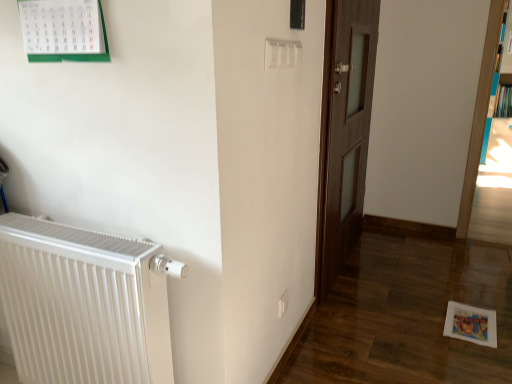
Question: Looking at their shapes, would you say dark wood door at center is wider or thinner than blue glossy bookcase at right, marked as the 1th bookcase in a back-to-front arrangement?

Choices:
 (A) wide
 (B) thin

Answer: (B)

Question: From a real-world perspective, is dark wood door at center positioned above or below blue glossy bookcase at right, the 2th bookcase viewed from the left?

Choices:
 (A) above
 (B) below

Answer: (B)

Question: Which is farther from the hardcover book at upper right?

Choices:
 (A) blue glossy bookcase at right, the 2th bookcase viewed from the left
 (B) white plastic electric outlet at lower center
 (C) dark wood door at center
 (D) wooden bookshelf at right, arranged as the 1th bookcase when viewed from the front
 (E) white metallic radiator at left

Answer: (E)

Question: Which of these objects is positioned closest to the hardcover book at upper right?

Choices:
 (A) dark wood door at center
 (B) wooden bookshelf at right, which is counted as the 1th bookcase, starting from the left
 (C) blue glossy bookcase at right, the 2th bookcase viewed from the left
 (D) white metallic radiator at left
 (E) white plastic electric outlet at lower center

Answer: (C)